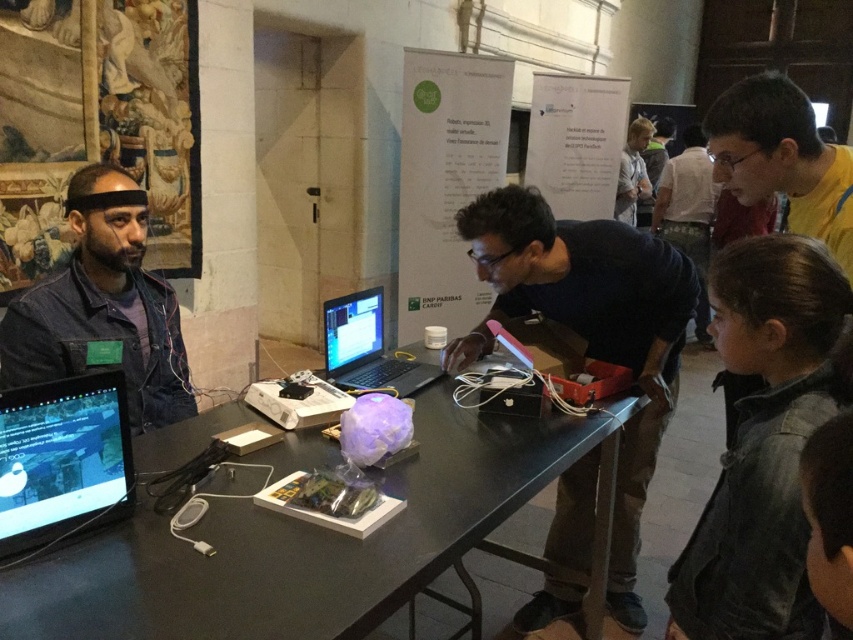
Which is above, black glossy table at center or matte black shirt at upper right?

matte black shirt at upper right

Which is in front, point (308, 560) or point (689, 218)?

Point (308, 560) is in front.

Where is `black glossy table at center`? The image size is (853, 640). black glossy table at center is located at coordinates (314, 545).

I want to click on matte black laptop at left, so click(x=62, y=460).

Who is more forward, (6, 528) or (672, 157)?

Positioned in front is point (6, 528).

Does point (103, 458) come in front of point (672, 186)?

Yes, it is in front of point (672, 186).

At what (x,y) coordinates should I click in order to perform the action: click on matte black laptop at left. Please return your answer as a coordinate pair (x, y). The width and height of the screenshot is (853, 640). Looking at the image, I should click on (62, 460).

Which of these two, denim jacket at left or yellow fabric shirt at upper right, stands shorter?

Standing shorter between the two is yellow fabric shirt at upper right.

Which is in front, point (115, 300) or point (819, 184)?

Point (819, 184)

Find the location of `denim jacket at left`. denim jacket at left is located at coordinates (102, 307).